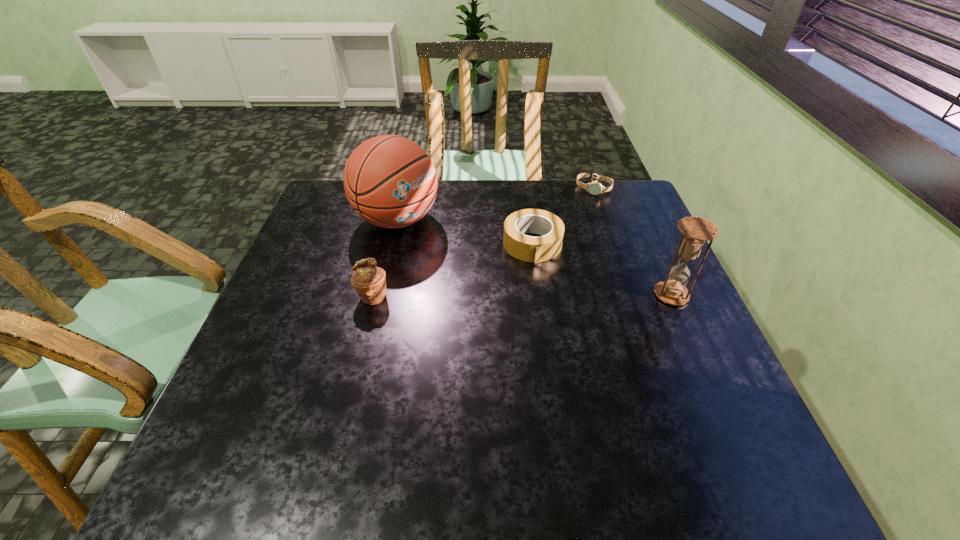
Where is `hourglass that is at the right edge`? The width and height of the screenshot is (960, 540). hourglass that is at the right edge is located at coordinates (695, 231).

Locate an element on the screen. This screenshot has height=540, width=960. watch at the right edge is located at coordinates (595, 188).

This screenshot has width=960, height=540. What are the coordinates of `object located in the far left corner section of the desktop` in the screenshot? It's located at (390, 181).

The image size is (960, 540). I want to click on object that is at the far right corner, so click(595, 188).

Find the location of a particular element. The width and height of the screenshot is (960, 540). vacant region at the far edge of the desktop is located at coordinates (458, 215).

The width and height of the screenshot is (960, 540). In the image, there is a desktop. What are the coordinates of `free space at the near edge` in the screenshot? It's located at (653, 407).

Locate an element on the screen. This screenshot has height=540, width=960. free space at the left edge of the desktop is located at coordinates pyautogui.click(x=278, y=313).

Find the location of a particular element. vacant area at the right edge of the desktop is located at coordinates (642, 287).

Locate an element on the screen. The image size is (960, 540). free space at the far left corner of the desktop is located at coordinates (313, 213).

The image size is (960, 540). In order to click on vacant space at the near left corner of the desktop in this screenshot , I will do tap(300, 394).